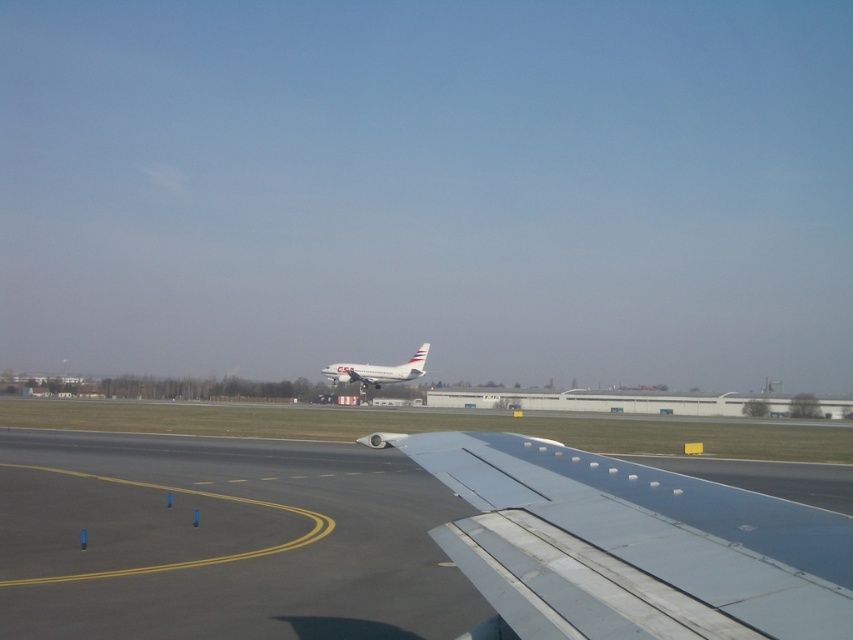
You are a pilot preparing to taxi your plane. You see the smooth asphalt tarmac at lower center and the white matte airplane at center. Which object is positioned to the right of the other?

The smooth asphalt tarmac at lower center is to the right of the white matte airplane at center.

You are a pilot preparing for takeoff and notice the smooth asphalt tarmac at lower center and the white matte airplane at center in your line of sight. Which object is nearer to your cockpit window?

The smooth asphalt tarmac at lower center is closer to the viewer than the white matte airplane at center, so the smooth asphalt tarmac at lower center is nearer to your cockpit window.

You are a pilot preparing for takeoff and need to align your aircraft with the runway. You notice the smooth asphalt tarmac at lower center in your view. Based on its position, what coordinate should you aim for to ensure proper alignment?

The smooth asphalt tarmac at lower center is positioned at coordinate point (404, 544), so you should aim for that coordinate to ensure proper alignment.